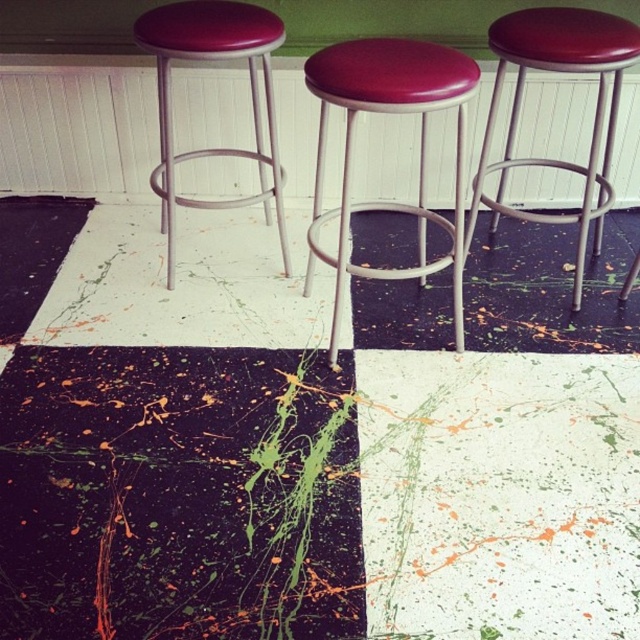
You are standing in the room described in the scene. You see a point marked at coordinates (x=557, y=72). What object is located at that point?

The point at coordinates (x=557, y=72) is occupied by the matte red stool at right.

You are standing in the room and want to place a new decorative item between the matte red stool at right and the matte vinyl stool at left. Based on their positions, which stool is closer to the center of the room?

The matte red stool at right is located below the matte vinyl stool at left, so the matte red stool at right is closer to the center of the room.

You are a decorator arranging the matte red stool at right and the matte vinyl stool at left in the room. If you want to place them side by side on the white half of the checkerboard floor, which stool requires more space horizontally?

The matte red stool at right requires more space horizontally because its width surpasses that of the matte vinyl stool at left.